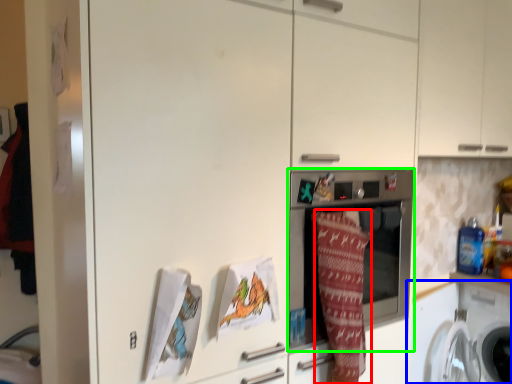
Question: Considering the real-world distances, which object is closest to blanket (highlighted by a red box)? washing machine (highlighted by a blue box) or home appliance (highlighted by a green box).

Choices:
 (A) washing machine
 (B) home appliance

Answer: (B)